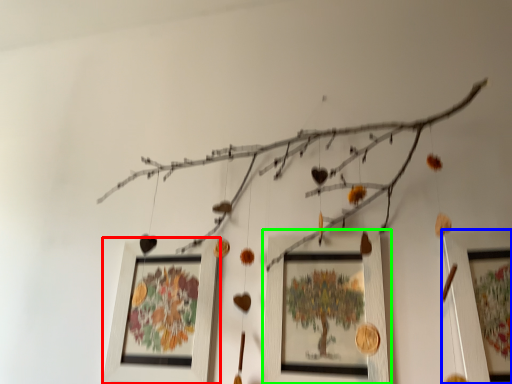
Question: Which object is positioned farthest from picture frame (highlighted by a red box)? Select from picture frame (highlighted by a blue box) and picture frame (highlighted by a green box).

Choices:
 (A) picture frame
 (B) picture frame

Answer: (A)